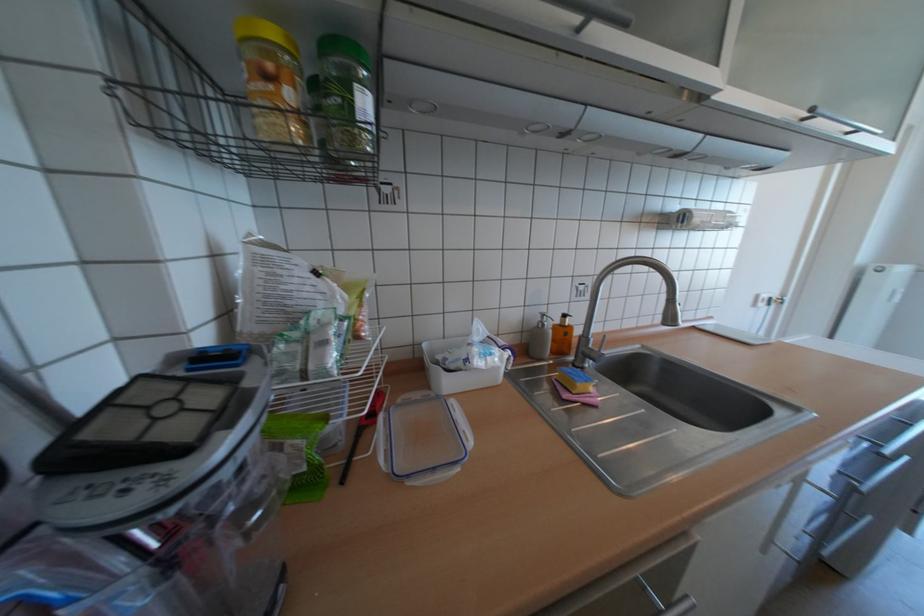
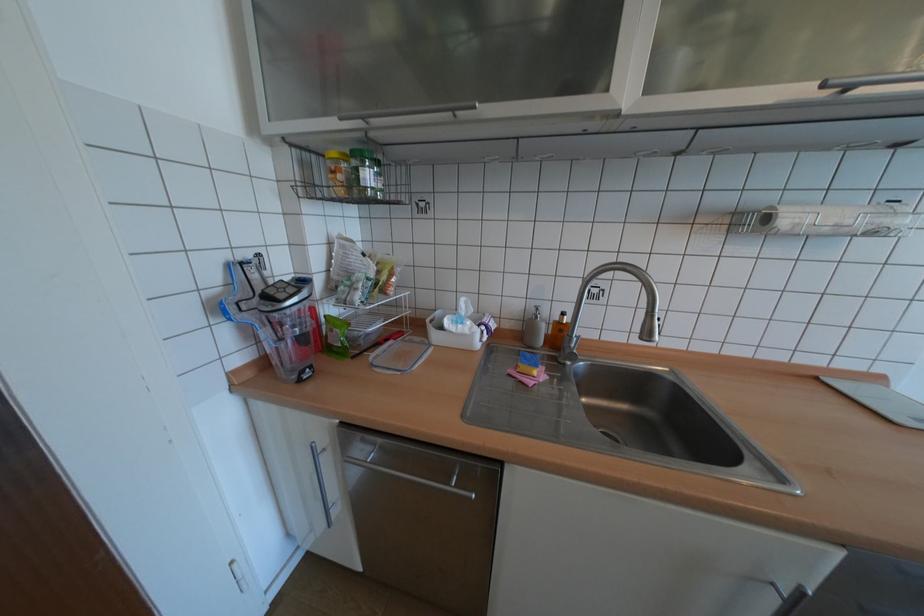
Where in the second image is the point corresponding to the point at 582,392 from the first image?

(527, 371)